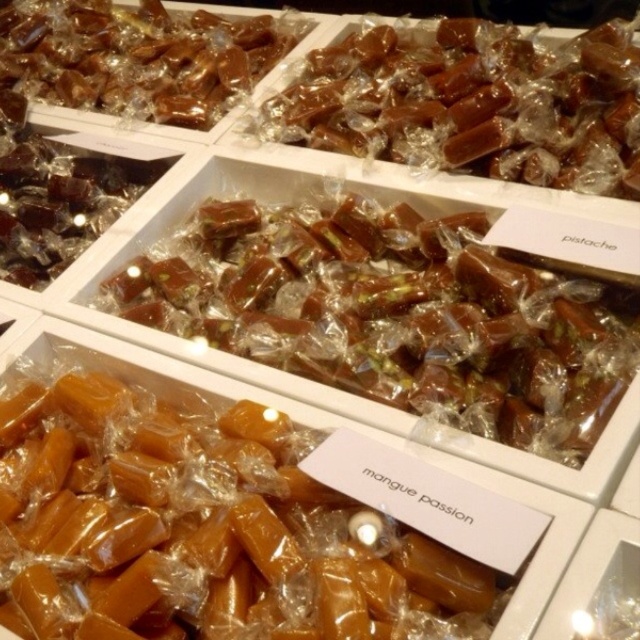
Between matte brown caramel at upper center and matte brown caramel at upper left, which one appears on the left side from the viewer's perspective?

matte brown caramel at upper left is more to the left.

Does matte brown caramel at upper center appear on the left side of matte brown caramel at upper left?

No, matte brown caramel at upper center is not to the left of matte brown caramel at upper left.

Does point (426, 102) lie in front of point (218, 17)?

That is True.

This screenshot has height=640, width=640. I want to click on matte brown caramel at upper center, so click(x=474, y=104).

Who is lower down, translucent caramel at center or matte brown caramel at upper center?

translucent caramel at center is lower down.

Is point (397, 252) positioned before point (358, 99)?

Yes, it is in front of point (358, 99).

The image size is (640, 640). Identify the location of translucent caramel at center. (394, 316).

Locate an element on the screen. This screenshot has width=640, height=640. translucent caramel at center is located at coordinates (394, 316).

Where is `translucent caramel at center`? translucent caramel at center is located at coordinates (394, 316).

Is translucent caramel at center further to camera compared to matte brown caramel at upper left?

No.

I want to click on translucent caramel at center, so click(394, 316).